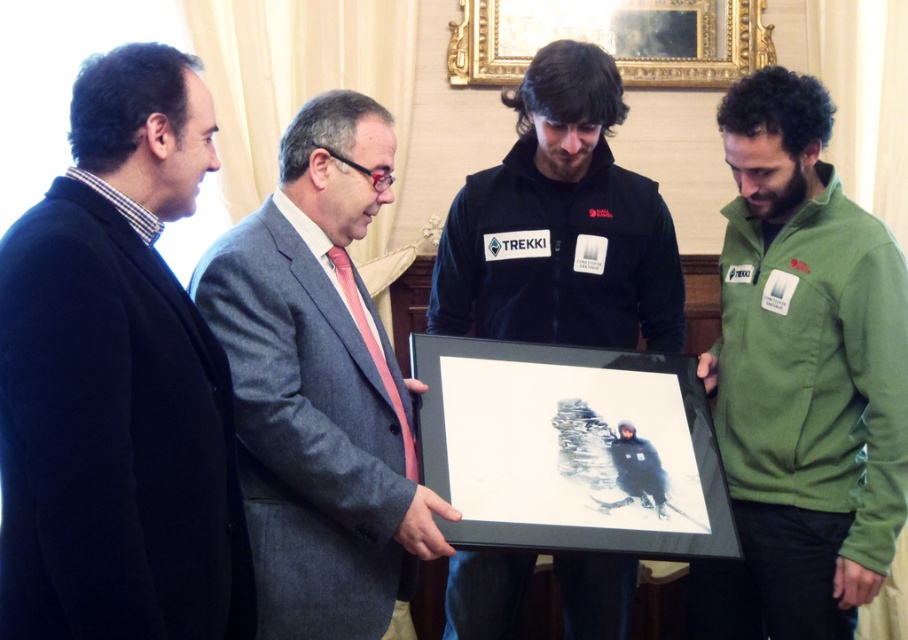
Does point (813, 156) lie in front of point (703, 26)?

Yes, point (813, 156) is in front of point (703, 26).

Can you confirm if green fleece jacket at center is bigger than gold/gilded picture frame at upper center?

Yes, green fleece jacket at center is bigger than gold/gilded picture frame at upper center.

You are a GUI agent. You are given a task and a screenshot of the screen. Output one action in this format:
    pyautogui.click(x=<x>, y=<y>)
    Task: Click on the green fleece jacket at center
    
    Given the screenshot: What is the action you would take?
    pyautogui.click(x=801, y=378)

What are the coordinates of `green fleece jacket at center` in the screenshot? It's located at (801, 378).

In the scene shown: Is black wool coat at left shorter than gold/gilded picture frame at upper center?

In fact, black wool coat at left may be taller than gold/gilded picture frame at upper center.

Is point (180, 362) farther from camera compared to point (561, 12)?

That is False.

You are a GUI agent. You are given a task and a screenshot of the screen. Output one action in this format:
    pyautogui.click(x=<x>, y=<y>)
    Task: Click on the black wool coat at left
    The width and height of the screenshot is (908, 640).
    Given the screenshot: What is the action you would take?
    pyautogui.click(x=117, y=381)

Between gray wool suit at center and black fleece jacket at center, which one has less height?

black fleece jacket at center is shorter.

Find the location of a particular element. This screenshot has height=640, width=908. gray wool suit at center is located at coordinates (319, 385).